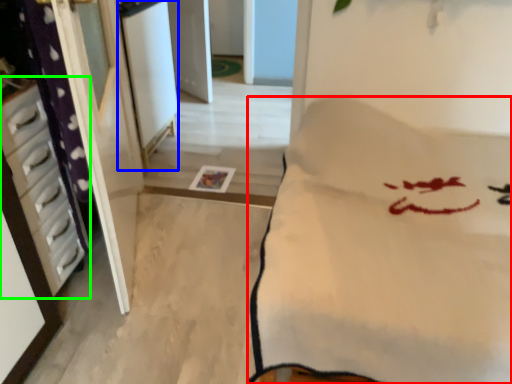
Question: Considering the real-world distances, which object is closest to furniture (highlighted by a red box)? screen door (highlighted by a blue box) or furniture (highlighted by a green box).

Choices:
 (A) screen door
 (B) furniture

Answer: (B)